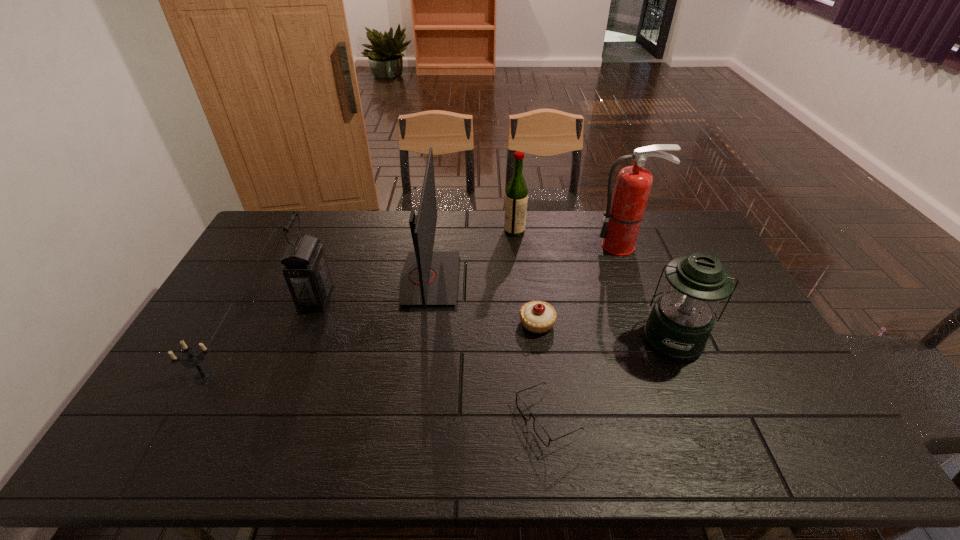
This screenshot has width=960, height=540. What are the coordinates of `free spot located 0.180m with the lenses facing outward on the shortest object` in the screenshot? It's located at (444, 418).

Identify the location of free point located with the lenses facing outward on the shortest object. The image size is (960, 540). (480, 418).

Where is `free space located with the lenses facing outward on the shortest object`? Image resolution: width=960 pixels, height=540 pixels. free space located with the lenses facing outward on the shortest object is located at coordinates (407, 418).

Where is `fire extinguisher that is at the far edge`? The image size is (960, 540). fire extinguisher that is at the far edge is located at coordinates (623, 216).

The height and width of the screenshot is (540, 960). In order to click on monitor that is positioned at the far edge in this screenshot , I will do `click(429, 277)`.

This screenshot has width=960, height=540. I want to click on liquor located in the far edge section of the desktop, so click(516, 196).

Where is `object that is positioned at the near edge`? The height and width of the screenshot is (540, 960). object that is positioned at the near edge is located at coordinates point(542,434).

Where is `object present at the left edge`? The width and height of the screenshot is (960, 540). object present at the left edge is located at coordinates (194, 358).

Find the location of a particular element. blank space at the far edge is located at coordinates (396, 220).

In order to click on vacant space at the near edge of the desktop in this screenshot , I will do `click(750, 430)`.